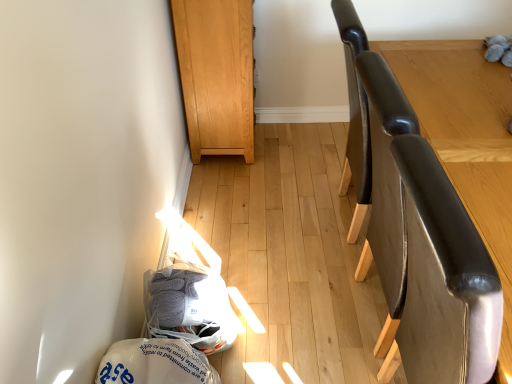
Question: Can you confirm if light brown wood cabinet at upper center is smaller than gray yarn at lower left, which is the 1th material from top to bottom?

Choices:
 (A) no
 (B) yes

Answer: (A)

Question: From a real-world perspective, is light brown wood cabinet at upper center located beneath gray yarn at lower left, which is counted as the 2th material, starting from the bottom?

Choices:
 (A) no
 (B) yes

Answer: (A)

Question: From a real-world perspective, is light brown wood cabinet at upper center on top of gray yarn at lower left, which is the 1th material from top to bottom?

Choices:
 (A) yes
 (B) no

Answer: (A)

Question: Can you confirm if light brown wood cabinet at upper center is positioned to the right of gray yarn at lower left, which is the 1th material from top to bottom?

Choices:
 (A) no
 (B) yes

Answer: (B)

Question: Considering the relative sizes of light brown wood cabinet at upper center and gray yarn at lower left, which is the 1th material from top to bottom, in the image provided, is light brown wood cabinet at upper center thinner than gray yarn at lower left, which is the 1th material from top to bottom,?

Choices:
 (A) yes
 (B) no

Answer: (B)

Question: Does light brown wood cabinet at upper center have a greater width compared to gray yarn at lower left, which is the 1th material from top to bottom?

Choices:
 (A) no
 (B) yes

Answer: (B)

Question: From the image's perspective, is glossy leather chair at right located beneath gray yarn at lower left, which is the 1th material from top to bottom?

Choices:
 (A) yes
 (B) no

Answer: (B)

Question: Can you confirm if glossy leather chair at right is thinner than gray yarn at lower left, which is the 1th material from top to bottom?

Choices:
 (A) no
 (B) yes

Answer: (A)

Question: Is glossy leather chair at right wider than gray yarn at lower left, which is counted as the 2th material, starting from the bottom?

Choices:
 (A) yes
 (B) no

Answer: (A)

Question: Can you confirm if glossy leather chair at right is shorter than gray yarn at lower left, which is the 1th material from top to bottom?

Choices:
 (A) yes
 (B) no

Answer: (B)

Question: Is glossy leather chair at right to the right of gray yarn at lower left, which is the 1th material from top to bottom, from the viewer's perspective?

Choices:
 (A) no
 (B) yes

Answer: (B)

Question: Is glossy leather chair at right facing away from gray yarn at lower left, which is counted as the 2th material, starting from the bottom?

Choices:
 (A) yes
 (B) no

Answer: (A)

Question: Is the position of light brown wood cabinet at upper center more distant than that of leather-like brown swivel chair at right?

Choices:
 (A) yes
 (B) no

Answer: (A)